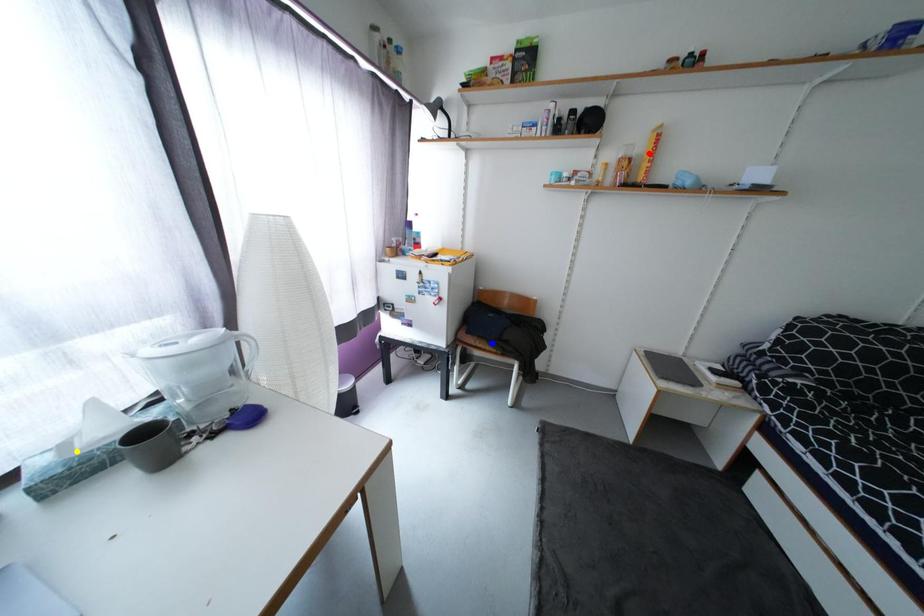
Order these from nearest to farthest:
red point | blue point | yellow point

yellow point → red point → blue point